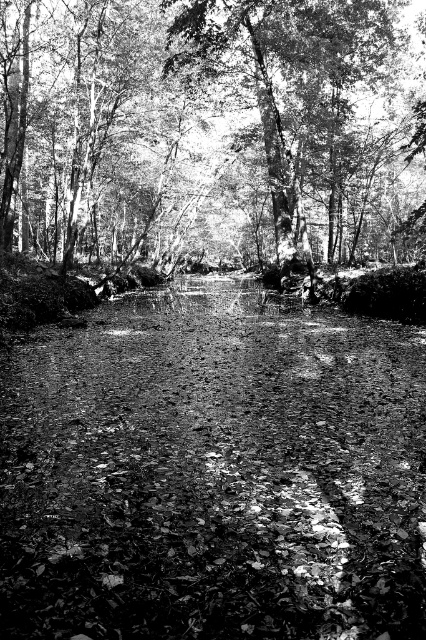
You are a hiker trying to cross the stream in the forest. You see a smooth dirt path at center and a smooth bark tree at center. Which one is narrower?

The smooth dirt path at center is thinner than the smooth bark tree at center, so the smooth dirt path at center is narrower.

You are a hiker who wants to take a photo of the smooth bark tree at center. You are currently standing on the smooth dirt path at center. Which direction should you face to ensure the tree is in the frame?

The smooth dirt path at center is positioned under the smooth bark tree at center, so facing upwards would ensure the tree is in the frame.

You are a hiker who wants to walk along the smooth dirt path at center. However, you notice a fallen branch blocking the path. The branch is as wide as the smooth bark tree at center. Can you step over the branch without leaving the path?

The smooth dirt path at center has a smaller size compared to smooth bark tree at center. Since the branch is as wide as the smooth bark tree at center, it is wider than the path. Therefore, you cannot step over the branch without leaving the path.